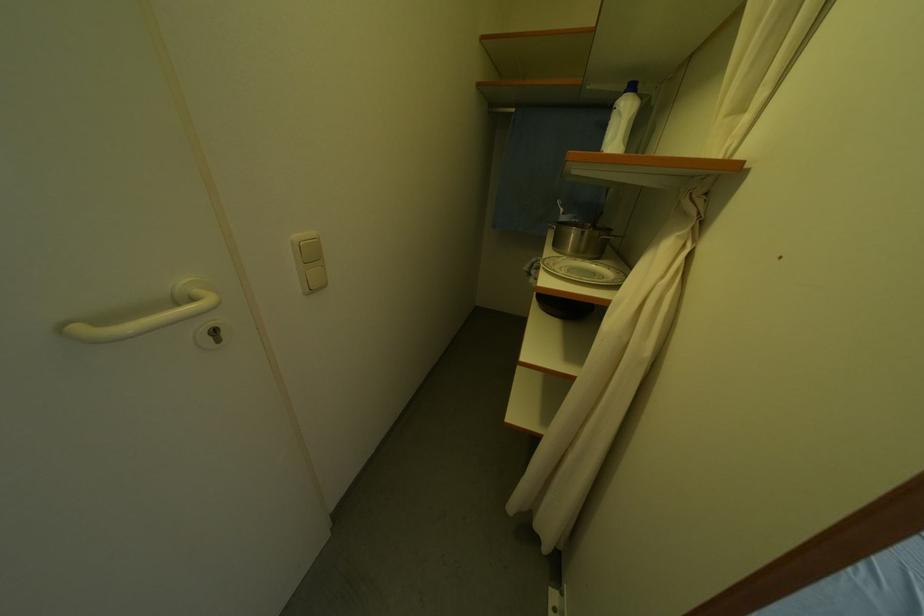
Find the location of `door keyhole`. door keyhole is located at coordinates (214, 334).